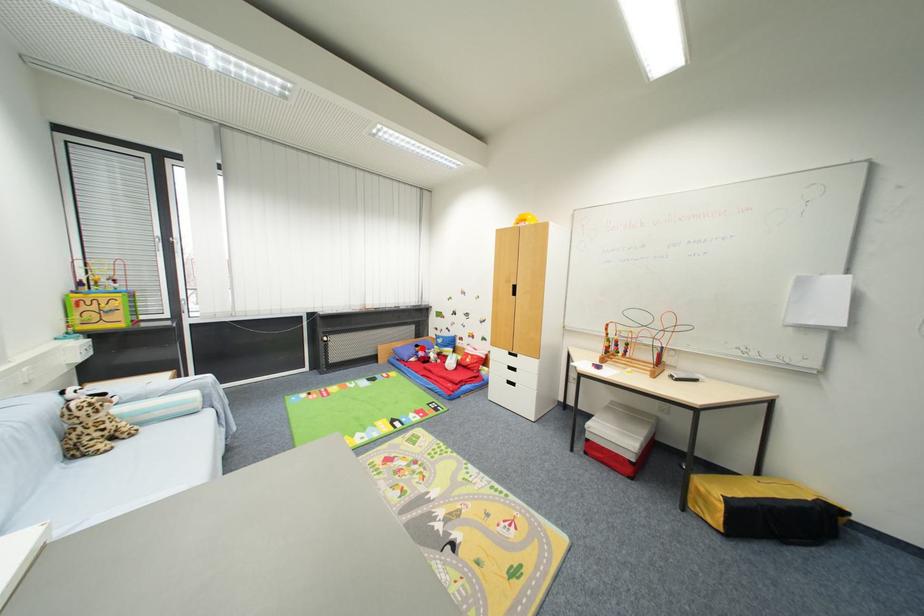
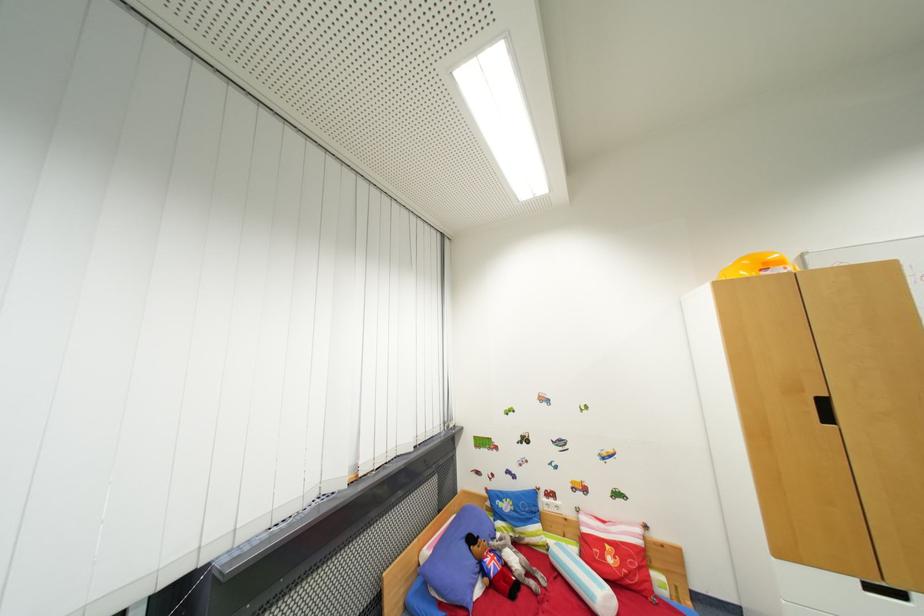
Find the pixel in the second image that matches the highlighted location in the first image.

(477, 541)